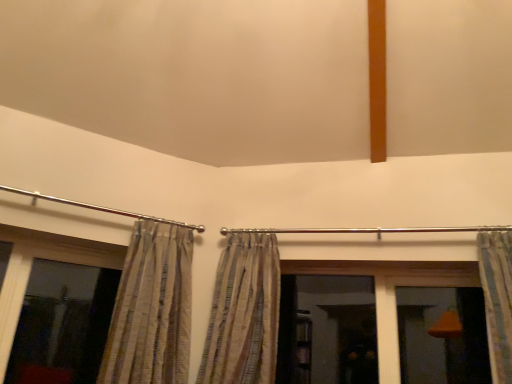
Question: Is point (258, 340) closer or farther from the camera than point (13, 269)?

Choices:
 (A) farther
 (B) closer

Answer: (B)

Question: Considering the positions of striped fabric curtain at center, which is the second curtain from right to left, and transparent glass window at left in the image, is striped fabric curtain at center, which is the second curtain from right to left, wider or thinner than transparent glass window at left?

Choices:
 (A) wide
 (B) thin

Answer: (A)

Question: Which object is positioned farthest from the striped fabric curtain at right, the third curtain when ordered from left to right?

Choices:
 (A) transparent glass window at left
 (B) striped fabric curtain at center, which is the second curtain from right to left
 (C) striped fabric curtain at left, which is the third curtain from right to left

Answer: (A)

Question: Which is farther from the striped fabric curtain at left, which is the first curtain in left-to-right order?

Choices:
 (A) striped fabric curtain at right, which ranks as the 1th curtain in right-to-left order
 (B) striped fabric curtain at center, which is the second curtain from right to left
 (C) transparent glass window at left

Answer: (A)